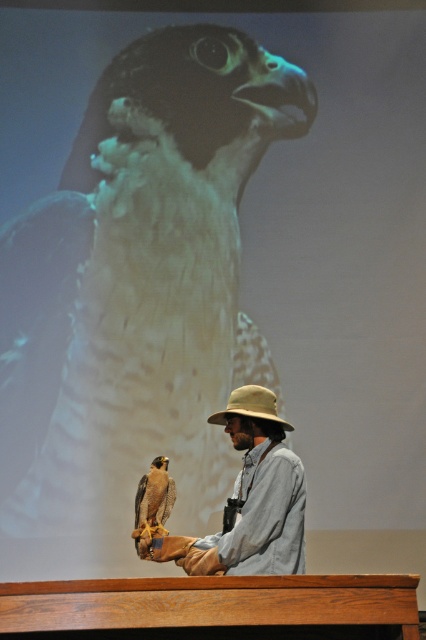
You are a wildlife photographer standing 2 meters away from the podium where the brown feathered falcon at lower left is perched. If you want to get a closer shot without moving, can you use a telephoto lens with a minimum focusing distance of 2.5 meters?

The distance between the brown feathered falcon at lower left and the viewer is 3.25 meters. Since the telephoto lens has a minimum focusing distance of 2.5 meters, which is less than the current distance of 3.25 meters, you can use it to get a closer shot without moving.

You are a photographer trying to capture a clear shot of the brown feathered falcon at lower left and the khaki fabric hat at center. Which object should you focus on first if you want to ensure both are in focus, considering their positions?

The khaki fabric hat at center is to the right of the brown feathered falcon at lower left, so you should focus on the brown feathered falcon at lower left first as it is closer to the camera.

You are a photographer trying to capture the brown feathered falcon at center and the khaki fabric hat at center in the same frame. Which object should you adjust your camera to focus on first if you want to ensure both are in the shot?

The brown feathered falcon at center is to the left of khaki fabric hat at center, so you should focus on the brown feathered falcon at center first to ensure both are in the shot.